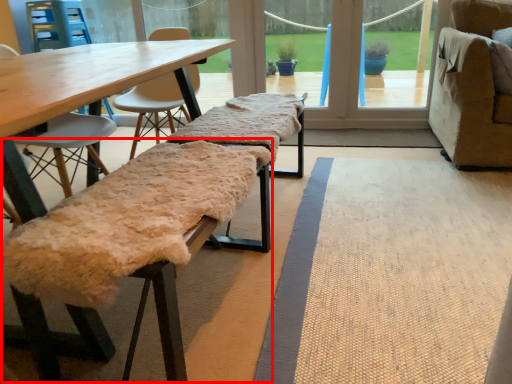
Question: From the image's perspective, where is park bench (annotated by the red box) located in relation to park bench in the image?

Choices:
 (A) above
 (B) below

Answer: (B)